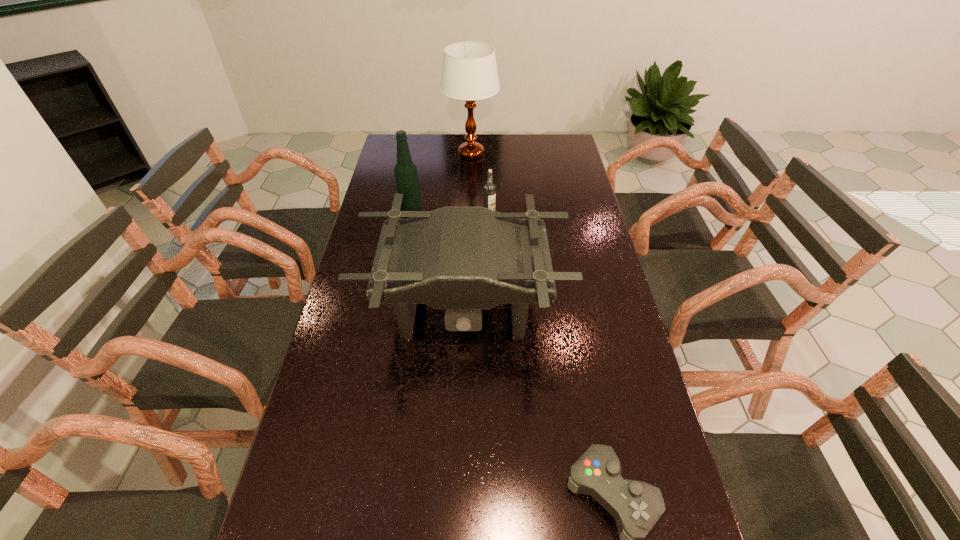
Locate an element on the screen. table lamp is located at coordinates pyautogui.click(x=469, y=73).

Where is `the farthest object`? Image resolution: width=960 pixels, height=540 pixels. the farthest object is located at coordinates (469, 73).

Locate an element on the screen. This screenshot has width=960, height=540. alcohol is located at coordinates (406, 175).

Where is `the third tallest object`? This screenshot has height=540, width=960. the third tallest object is located at coordinates (463, 260).

The height and width of the screenshot is (540, 960). What are the coordinates of `the fourth farthest object` in the screenshot? It's located at (463, 260).

The width and height of the screenshot is (960, 540). Find the location of `the fourth tallest object`. the fourth tallest object is located at coordinates (489, 189).

Find the location of a particular element. free spot located on the front of the farthest object is located at coordinates (469, 206).

Find the location of a particular element. This screenshot has width=960, height=540. vacant space located 0.310m on the back of the second tallest object is located at coordinates (420, 163).

Identify the location of vacant space situated 0.250m with a camera mounted on the underside of the drone. This screenshot has height=540, width=960. (459, 465).

At what (x,y) coordinates should I click in order to perform the action: click on vacant space located on the label of the second shortest object. Please return your answer as a coordinate pair (x, y). The width and height of the screenshot is (960, 540). Looking at the image, I should click on (491, 256).